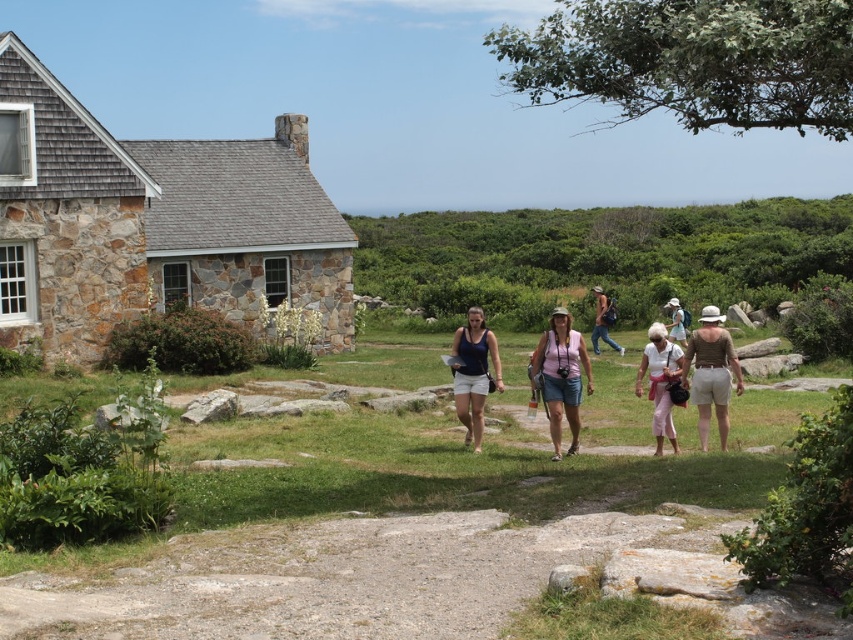
You are standing at the stone house and want to walk towards the two points marked in the image. Which point, point [683,362] or point [601,336], is closer to you?

Point [683,362] is closer to the viewer than point [601,336].